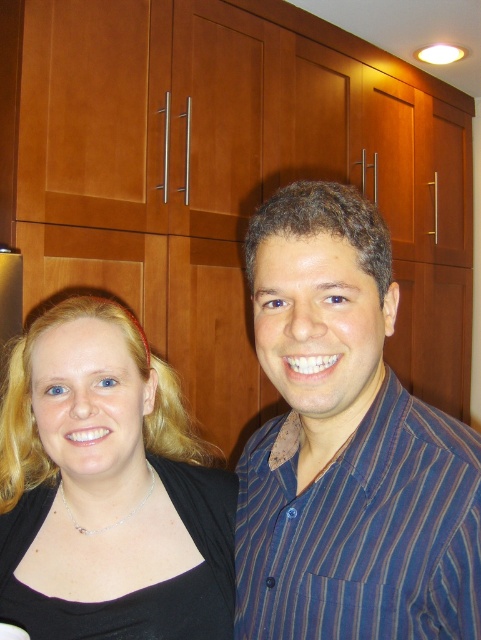
Question: Among these points, which one is farthest from the camera?

Choices:
 (A) (41, 524)
 (B) (290, 611)
 (C) (320, 564)

Answer: (A)

Question: Which point is closer to the camera?

Choices:
 (A) (395, 488)
 (B) (286, 532)

Answer: (A)

Question: Does black fabric at center appear on the left side of blue striped shirt at center?

Choices:
 (A) no
 (B) yes

Answer: (B)

Question: Does matte black shirt at center have a larger size compared to black fabric at center?

Choices:
 (A) no
 (B) yes

Answer: (A)

Question: Is matte black shirt at center positioned at the back of black fabric at center?

Choices:
 (A) yes
 (B) no

Answer: (B)

Question: Considering the real-world distances, which object is farthest from the blue striped shirt at center?

Choices:
 (A) black fabric at center
 (B) matte black shirt at center

Answer: (A)